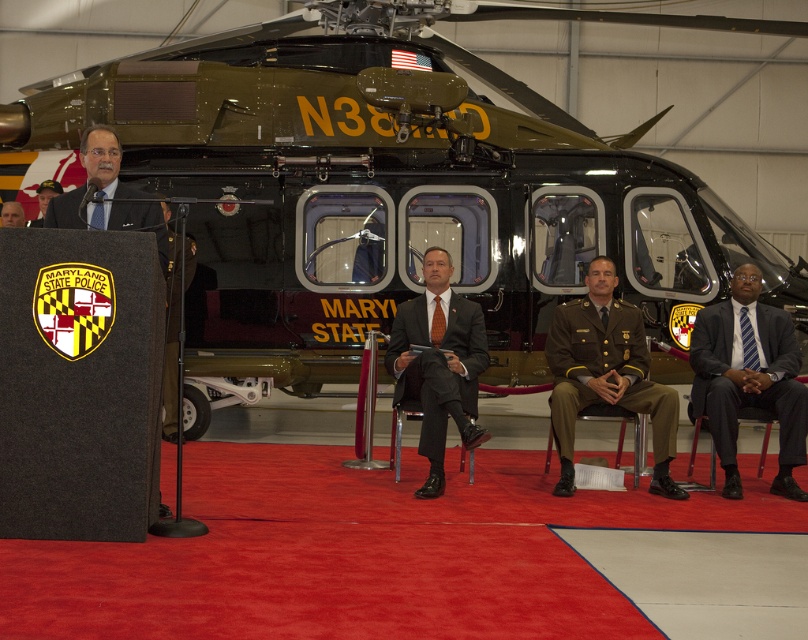
Question: Estimate the real-world distances between objects in this image. Which object is closer to the khaki uniform at center?

Choices:
 (A) matte black suit at left
 (B) green matte helicopter at center

Answer: (B)

Question: Can you confirm if dark blue suit at center is bigger than green fabric uniform at center?

Choices:
 (A) no
 (B) yes

Answer: (A)

Question: Does green matte helicopter at center appear on the left side of khaki uniform at center?

Choices:
 (A) no
 (B) yes

Answer: (B)

Question: Which point is closer to the camera?

Choices:
 (A) tap(613, 348)
 (B) tap(457, 332)

Answer: (B)

Question: Which of the following is the farthest from the observer?

Choices:
 (A) matte black suit at center
 (B) light brown leather jacket at left

Answer: (B)

Question: Is dark blue suit at center below green fabric uniform at center?

Choices:
 (A) yes
 (B) no

Answer: (A)